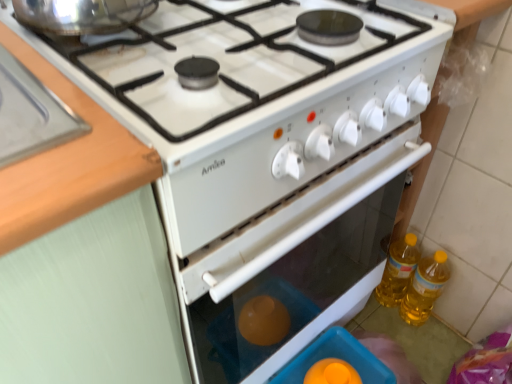
Question: Is the depth of wooden at left less than that of yellow translucent bottle at lower right, acting as the first bottle starting from the right?

Choices:
 (A) yes
 (B) no

Answer: (A)

Question: From the image's perspective, is wooden at left under yellow translucent bottle at lower right, acting as the first bottle starting from the right?

Choices:
 (A) yes
 (B) no

Answer: (B)

Question: Can you confirm if wooden at left is taller than yellow translucent bottle at lower right, acting as the second bottle starting from the left?

Choices:
 (A) no
 (B) yes

Answer: (A)

Question: Can yellow translucent bottle at lower right, acting as the first bottle starting from the right, be found inside wooden at left?

Choices:
 (A) no
 (B) yes

Answer: (A)

Question: Is wooden at left aimed at yellow translucent bottle at lower right, acting as the first bottle starting from the right?

Choices:
 (A) yes
 (B) no

Answer: (B)

Question: Can you confirm if wooden at left is positioned to the right of yellow translucent bottle at lower right, acting as the first bottle starting from the right?

Choices:
 (A) no
 (B) yes

Answer: (A)

Question: Is yellow translucent bottle at right, arranged as the second bottle when viewed from the right, aimed at yellow translucent bottle at lower right, acting as the second bottle starting from the left?

Choices:
 (A) no
 (B) yes

Answer: (A)

Question: Does yellow translucent bottle at right, which appears as the 1th bottle when viewed from the left, come in front of yellow translucent bottle at lower right, acting as the second bottle starting from the left?

Choices:
 (A) yes
 (B) no

Answer: (B)

Question: From a real-world perspective, is yellow translucent bottle at right, arranged as the second bottle when viewed from the right, below yellow translucent bottle at lower right, acting as the second bottle starting from the left?

Choices:
 (A) yes
 (B) no

Answer: (A)

Question: Would you say yellow translucent bottle at lower right, acting as the second bottle starting from the left, is part of yellow translucent bottle at right, arranged as the second bottle when viewed from the right,'s contents?

Choices:
 (A) yes
 (B) no

Answer: (B)

Question: Considering the relative sizes of yellow translucent bottle at right, arranged as the second bottle when viewed from the right, and yellow translucent bottle at lower right, acting as the second bottle starting from the left, in the image provided, is yellow translucent bottle at right, arranged as the second bottle when viewed from the right, smaller than yellow translucent bottle at lower right, acting as the second bottle starting from the left,?

Choices:
 (A) yes
 (B) no

Answer: (B)

Question: Is yellow translucent bottle at lower right, acting as the first bottle starting from the right, at the back of yellow translucent bottle at right, which appears as the 1th bottle when viewed from the left?

Choices:
 (A) no
 (B) yes

Answer: (A)

Question: Is wooden at left shorter than yellow translucent bottle at right, which appears as the 1th bottle when viewed from the left?

Choices:
 (A) no
 (B) yes

Answer: (B)